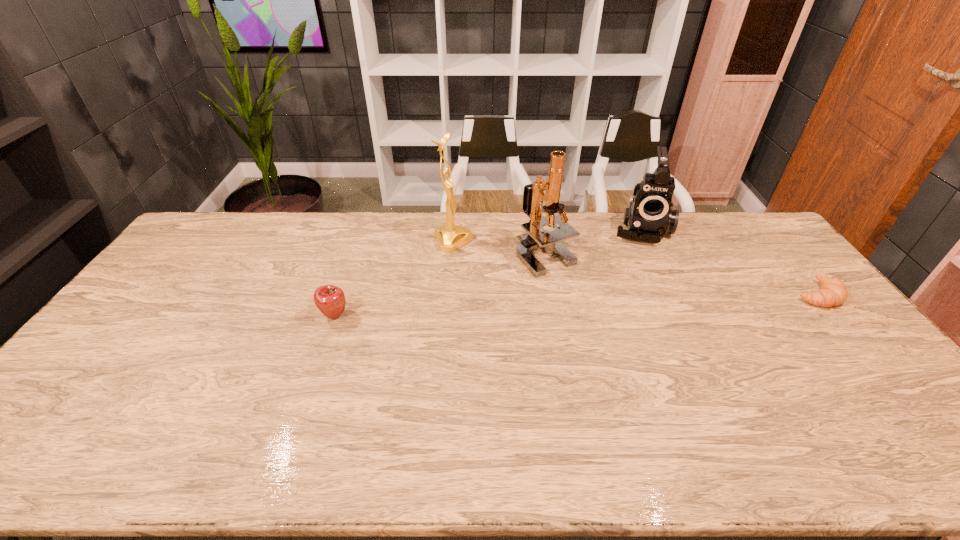
The image size is (960, 540). Identify the location of blank space located at the eyepiece of the microscope. (559, 308).

Identify the location of free space located 0.220m at the eyepiece of the microscope. The height and width of the screenshot is (540, 960). (564, 328).

Locate an element on the screen. vacant space situated at the eyepiece of the microscope is located at coordinates (560, 313).

Locate an element on the screen. The image size is (960, 540). vacant space located on the front-facing side of the fourth object from right to left is located at coordinates (493, 261).

Locate an element on the screen. vacant area situated on the front-facing side of the fourth object from right to left is located at coordinates (512, 270).

Where is `free space located on the front-facing side of the fourth object from right to left`? free space located on the front-facing side of the fourth object from right to left is located at coordinates (502, 266).

Locate an element on the screen. The width and height of the screenshot is (960, 540). vacant region located 0.240m on the lens mount of the third tallest object is located at coordinates (642, 292).

This screenshot has width=960, height=540. Identify the location of vacant space located 0.230m on the lens mount of the third tallest object. (642, 289).

Locate an element on the screen. The image size is (960, 540). blank space located on the lens mount of the third tallest object is located at coordinates (643, 305).

This screenshot has width=960, height=540. Find the location of `microscope at the far edge`. microscope at the far edge is located at coordinates (536, 238).